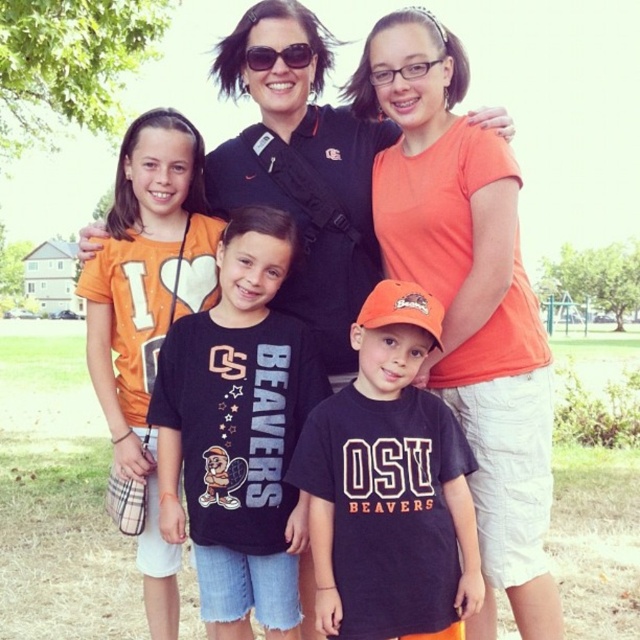
You are a photographer trying to capture a group shot of the dark blue cotton shirt at center and the orange cotton shirt at left. Since you want to ensure both are in the frame, which direction should you move to include both in your camera view?

The dark blue cotton shirt at center is to the right of the orange cotton shirt at left. To include both in your camera view, you should move to the left side so that you can capture both the dark blue cotton shirt at center and the orange cotton shirt at left in the frame.

You are a photographer trying to capture a group photo. You notice two shirts in the image, the dark blue cotton shirt at center and the orange cotton shirt at left. Which shirt is positioned higher in the image?

The dark blue cotton shirt at center is positioned higher in the image than the orange cotton shirt at left.